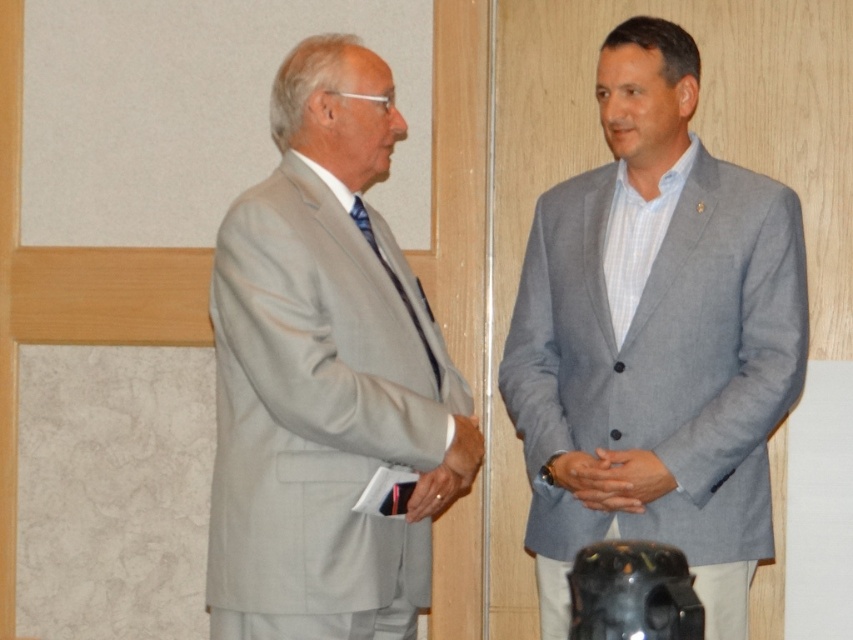
You are standing in the room where the two men are talking. You need to locate the gray fabric suit at right. Where would you look in terms of horizontal and vertical position?

The gray fabric suit at right is located at the 2D coordinates of point 0.523 horizontally and 0.770 vertically.

You are an observer standing in front of the image. You notice the gray matte suit at left and the smooth gray hands at center. Which object is positioned more to the left?

The gray matte suit at left is positioned more to the left than the smooth gray hands at center.

You are an interior designer working on a layout for a meeting room. You need to place a sofa in the room such that it is directly in front of the gray matte suit at left. Where should you position the sofa?

The gray matte suit at left is located at coordinates point (326,376), so the sofa should be placed directly in front of this position to face the gray matte suit at left.